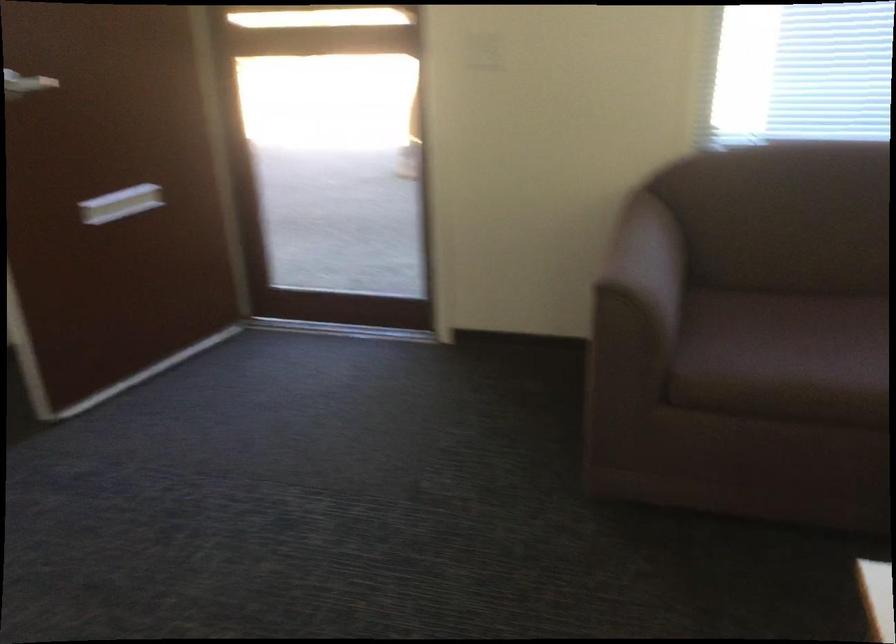
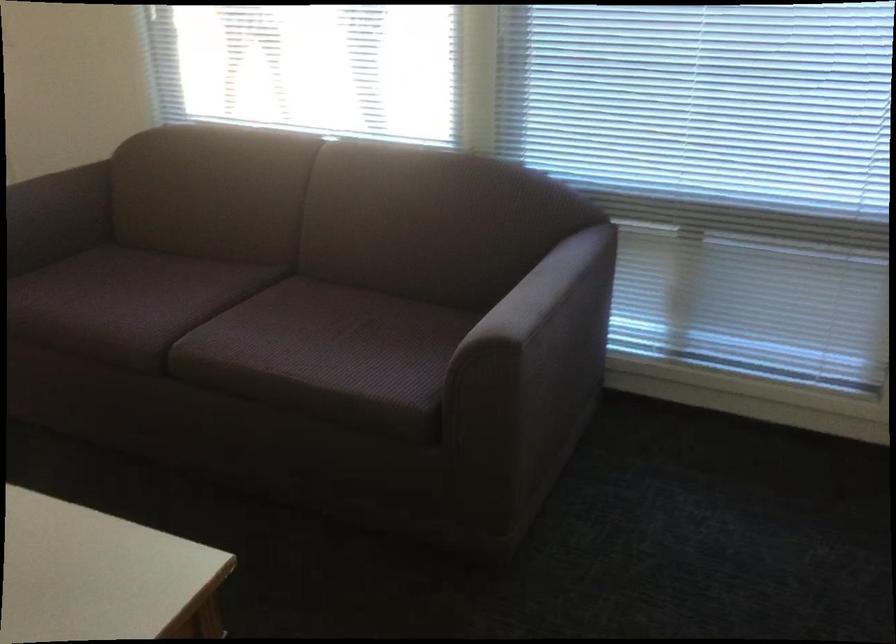
Question: What movement of the cameraman would produce the second image?

Choices:
 (A) Left
 (B) Right
 (C) Forward
 (D) Backward

Answer: (B)